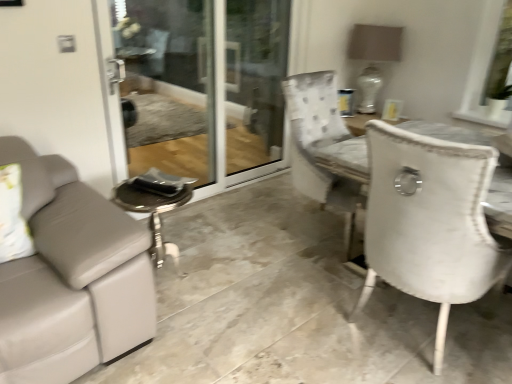
Question: From a real-world perspective, is transparent glass screen door at center beneath white ceramic lamp at upper right?

Choices:
 (A) no
 (B) yes

Answer: (B)

Question: Is the position of transparent glass screen door at center less distant than that of white ceramic lamp at upper right?

Choices:
 (A) yes
 (B) no

Answer: (A)

Question: Is transparent glass screen door at center to the right of white ceramic lamp at upper right from the viewer's perspective?

Choices:
 (A) no
 (B) yes

Answer: (A)

Question: Can you confirm if transparent glass screen door at center is taller than white ceramic lamp at upper right?

Choices:
 (A) no
 (B) yes

Answer: (B)

Question: Are transparent glass screen door at center and white ceramic lamp at upper right making contact?

Choices:
 (A) yes
 (B) no

Answer: (B)

Question: Would you consider transparent glass screen door at center to be distant from white ceramic lamp at upper right?

Choices:
 (A) yes
 (B) no

Answer: (A)

Question: Considering the relative sizes of white ceramic lamp at upper right and transparent glass screen door at center in the image provided, is white ceramic lamp at upper right bigger than transparent glass screen door at center?

Choices:
 (A) yes
 (B) no

Answer: (B)

Question: Does white ceramic lamp at upper right have a smaller size compared to transparent glass screen door at center?

Choices:
 (A) no
 (B) yes

Answer: (B)

Question: Is white ceramic lamp at upper right in front of transparent glass screen door at center?

Choices:
 (A) no
 (B) yes

Answer: (A)

Question: Does white ceramic lamp at upper right have a lesser height compared to transparent glass screen door at center?

Choices:
 (A) yes
 (B) no

Answer: (A)

Question: Does white ceramic lamp at upper right have a lesser width compared to transparent glass screen door at center?

Choices:
 (A) no
 (B) yes

Answer: (A)

Question: Is white ceramic lamp at upper right with transparent glass screen door at center?

Choices:
 (A) yes
 (B) no

Answer: (B)

Question: Is transparent glass screen door at center bigger than white fabric window screen at upper right?

Choices:
 (A) no
 (B) yes

Answer: (B)